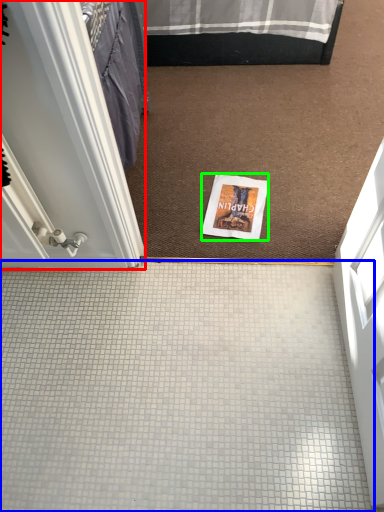
Question: Which object is the closest to the door (highlighted by a red box)? Choose among these: plain (highlighted by a blue box) or magazine (highlighted by a green box).

Choices:
 (A) plain
 (B) magazine

Answer: (A)